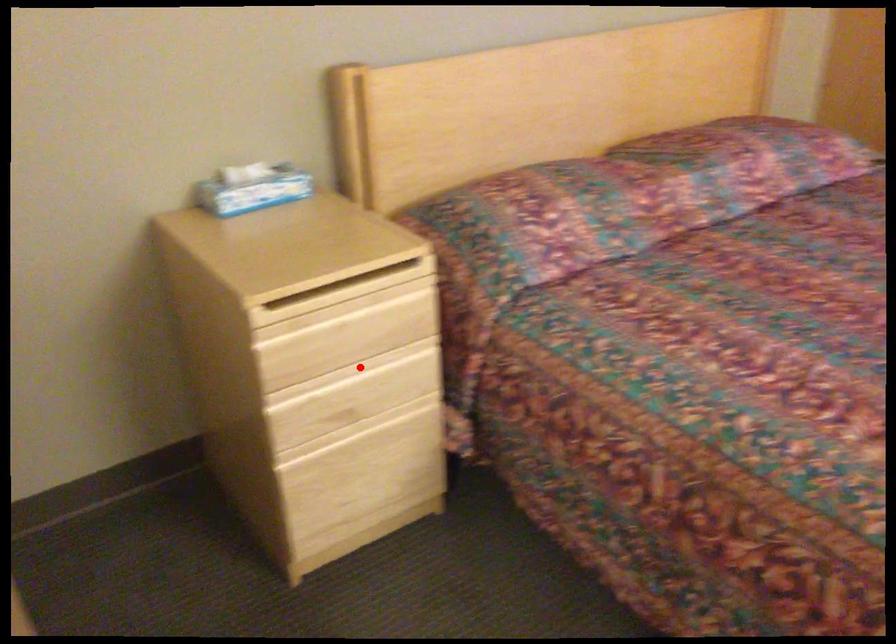
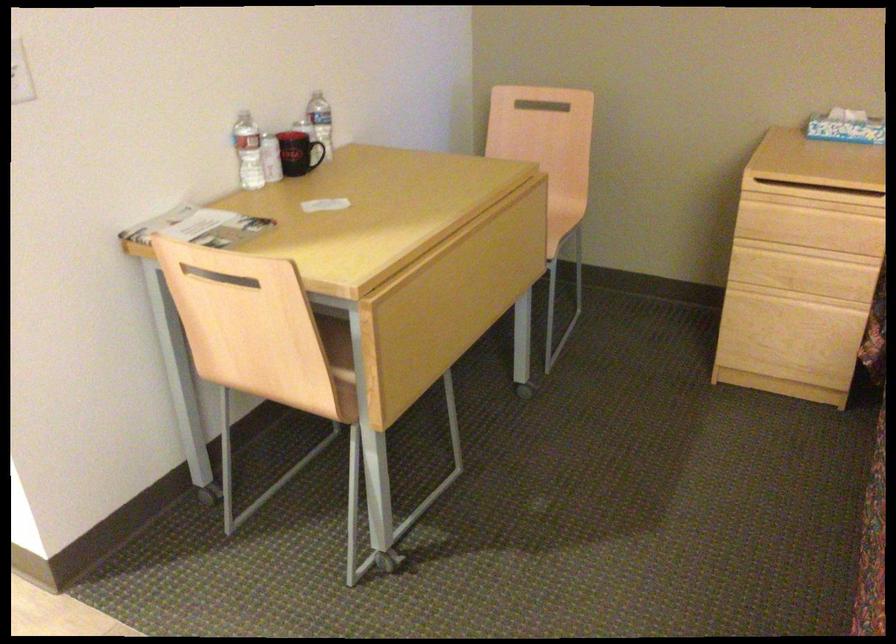
Question: I am providing you with two images of the same scene from different viewpoints. In image1, a red point is highlighted. Considering the same 3D point in image2, which of the following is correct?

Choices:
 (A) It is closer
 (B) It is farther

Answer: (B)